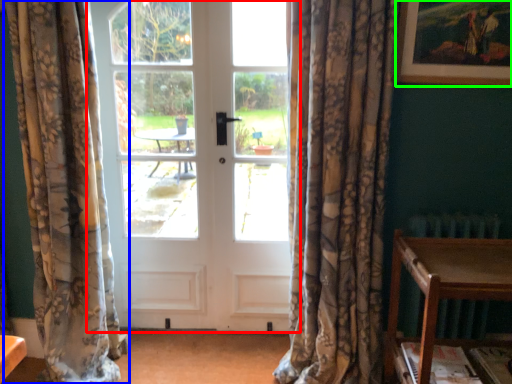
Question: Estimate the real-world distances between objects in this image. Which object is closer to door (highlighted by a red box), curtain (highlighted by a blue box) or picture frame (highlighted by a green box)?

Choices:
 (A) curtain
 (B) picture frame

Answer: (A)